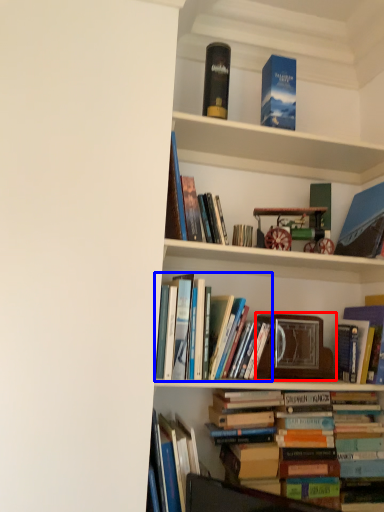
Question: Among these objects, which one is nearest to the camera, picture frame (highlighted by a red box) or book (highlighted by a blue box)?

Choices:
 (A) picture frame
 (B) book

Answer: (B)